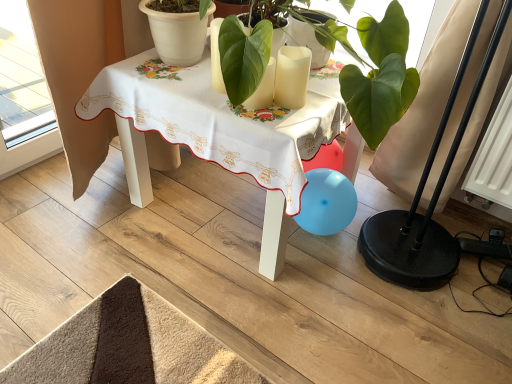
Question: From their relative heights in the image, would you say white matte candle at center is taller or shorter than white matte flowerpot at upper center?

Choices:
 (A) short
 (B) tall

Answer: (A)

Question: From the image's perspective, relative to white matte flowerpot at upper center, is white matte candle at center above or below?

Choices:
 (A) below
 (B) above

Answer: (A)

Question: Which object is the closest to the white fabric table at center?

Choices:
 (A) white matte flowerpot at upper center
 (B) white matte candle at center

Answer: (A)

Question: Estimate the real-world distances between objects in this image. Which object is closer to the white fabric table at center?

Choices:
 (A) white matte flowerpot at upper center
 (B) white matte candle at center

Answer: (A)